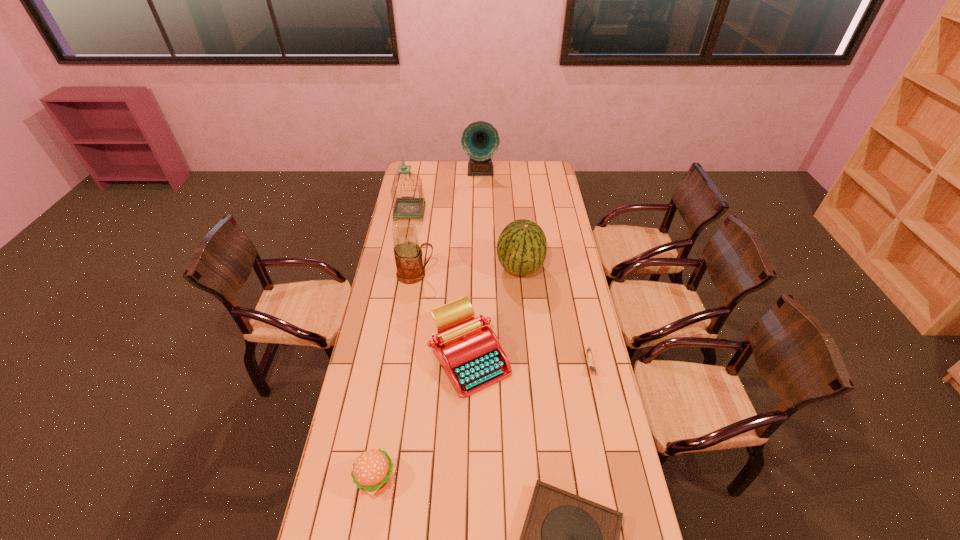
What are the coordinates of `the farthest object` in the screenshot? It's located at (480, 140).

At what (x,y) coordinates should I click in order to perform the action: click on the taller phonograph record. Please return your answer as a coordinate pair (x, y). The width and height of the screenshot is (960, 540). Looking at the image, I should click on (480, 140).

Where is `birdcage`? This screenshot has height=540, width=960. birdcage is located at coordinates (x=407, y=207).

The height and width of the screenshot is (540, 960). In order to click on watermelon in this screenshot , I will do `click(521, 248)`.

Where is `pitcher`? pitcher is located at coordinates (408, 254).

At what (x,y) coordinates should I click in order to perform the action: click on the fourth shortest object. Please return your answer as a coordinate pair (x, y). Looking at the image, I should click on (469, 351).

Image resolution: width=960 pixels, height=540 pixels. I want to click on the third shortest object, so click(x=372, y=470).

Locate an element on the screen. banana is located at coordinates (590, 362).

What are the coordinates of `free space located 0.170m from the horn of the farther phonograph record` in the screenshot? It's located at (480, 198).

Identify the location of vacant point located at the door of the seventh nearest object. (406, 230).